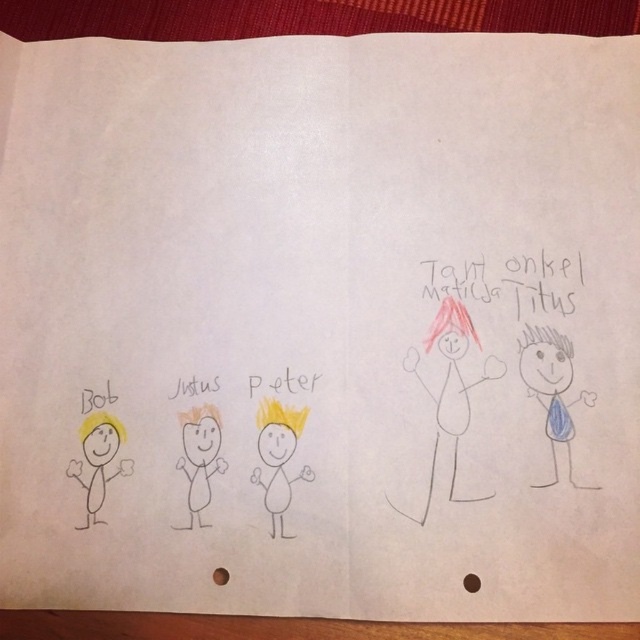
Question: Can you confirm if blue paper at right is positioned above yellow hair at center?

Choices:
 (A) no
 (B) yes

Answer: (B)

Question: Can you confirm if yellow paper at left is positioned to the right of yellow paper at bottom left?

Choices:
 (A) no
 (B) yes

Answer: (B)

Question: Among these objects, which one is farthest from the camera?

Choices:
 (A) yellow paper at bottom left
 (B) yellow paper at left

Answer: (A)

Question: Which of the following is the closest to the observer?

Choices:
 (A) handwritten text at upper right
 (B) yellow paper at left

Answer: (B)

Question: Which point is closer to the camera?

Choices:
 (A) (106, 401)
 (B) (544, 392)
 (C) (456, 417)
 (D) (88, 520)

Answer: (D)

Question: Observing the image, what is the correct spatial positioning of yellow paper at left in reference to yellow paper at bottom left?

Choices:
 (A) right
 (B) left

Answer: (A)